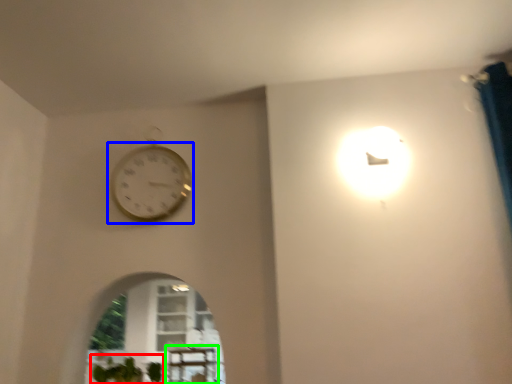
Question: Which is nearer to the plant (highlighted by a red box)? wall clock (highlighted by a blue box) or table (highlighted by a green box).

Choices:
 (A) wall clock
 (B) table

Answer: (B)